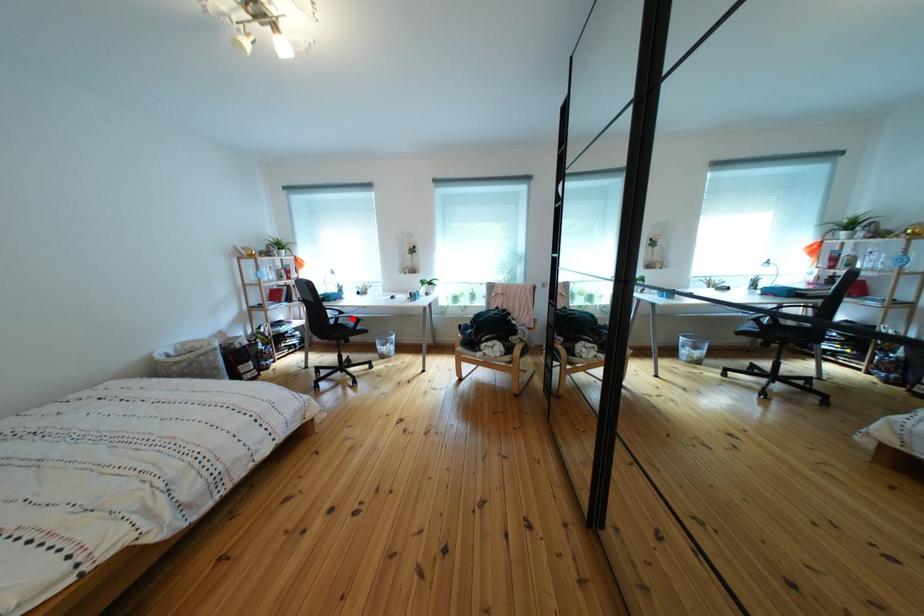
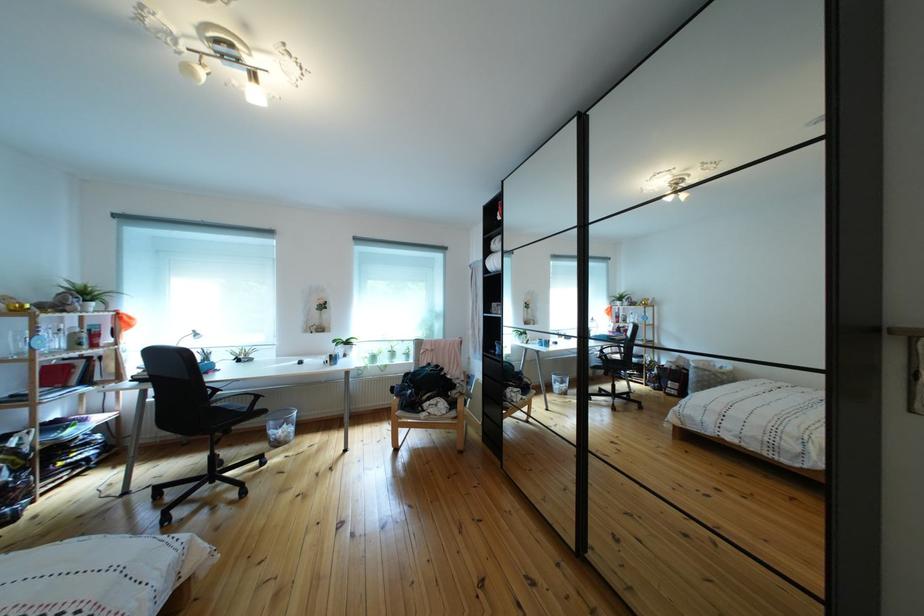
Question: I am providing you with two images of the same scene from different viewpoints. A red point is marked on the first image. Can you still see the location of the red point in image 2?

Choices:
 (A) Yes
 (B) No

Answer: (A)